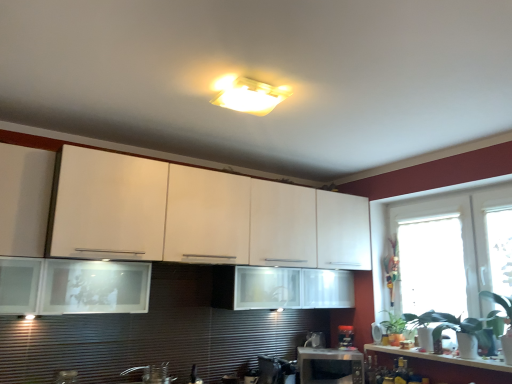
Question: Is matte plastic light fixture at center behind satin black coffee maker at lower center, arranged as the 1th appliance when viewed from the left?

Choices:
 (A) yes
 (B) no

Answer: (B)

Question: Considering the relative sizes of matte plastic light fixture at center and satin black coffee maker at lower center, placed as the 3th appliance when sorted from right to left, in the image provided, is matte plastic light fixture at center shorter than satin black coffee maker at lower center, placed as the 3th appliance when sorted from right to left,?

Choices:
 (A) no
 (B) yes

Answer: (B)

Question: Is matte plastic light fixture at center at the right side of satin black coffee maker at lower center, placed as the 3th appliance when sorted from right to left?

Choices:
 (A) no
 (B) yes

Answer: (A)

Question: From a real-world perspective, is matte plastic light fixture at center located beneath satin black coffee maker at lower center, arranged as the 1th appliance when viewed from the left?

Choices:
 (A) yes
 (B) no

Answer: (B)

Question: Could you tell me if matte plastic light fixture at center is turned towards satin black coffee maker at lower center, arranged as the 1th appliance when viewed from the left?

Choices:
 (A) yes
 (B) no

Answer: (B)

Question: Is matte plastic light fixture at center thinner than satin black coffee maker at lower center, arranged as the 1th appliance when viewed from the left?

Choices:
 (A) yes
 (B) no

Answer: (A)

Question: From a real-world perspective, is black plastic toaster at lower center, which is counted as the third appliance, starting from the left, positioned over brushed metal faucet at lower center based on gravity?

Choices:
 (A) no
 (B) yes

Answer: (B)

Question: From a real-world perspective, is black plastic toaster at lower center, positioned as the 1th appliance in right-to-left order, under brushed metal faucet at lower center?

Choices:
 (A) yes
 (B) no

Answer: (B)

Question: Would you say brushed metal faucet at lower center is part of black plastic toaster at lower center, positioned as the 1th appliance in right-to-left order,'s contents?

Choices:
 (A) no
 (B) yes

Answer: (A)

Question: Can you confirm if black plastic toaster at lower center, positioned as the 1th appliance in right-to-left order, is wider than brushed metal faucet at lower center?

Choices:
 (A) yes
 (B) no

Answer: (A)

Question: Does black plastic toaster at lower center, which is counted as the third appliance, starting from the left, turn towards brushed metal faucet at lower center?

Choices:
 (A) no
 (B) yes

Answer: (A)

Question: From the image's perspective, is black plastic toaster at lower center, which is counted as the third appliance, starting from the left, located beneath matte plastic light fixture at center?

Choices:
 (A) yes
 (B) no

Answer: (A)